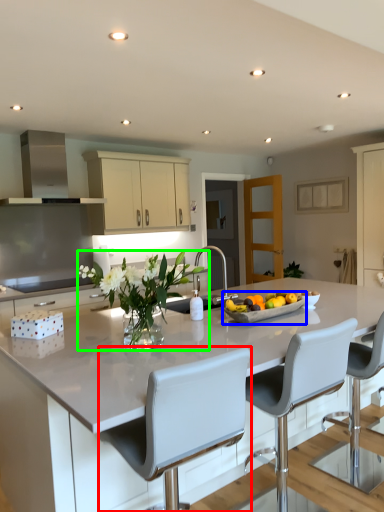
Question: Considering the real-world distances, which object is closest to chair (highlighted by a red box)? fruit dish (highlighted by a blue box) or floral arrangement (highlighted by a green box).

Choices:
 (A) fruit dish
 (B) floral arrangement

Answer: (B)